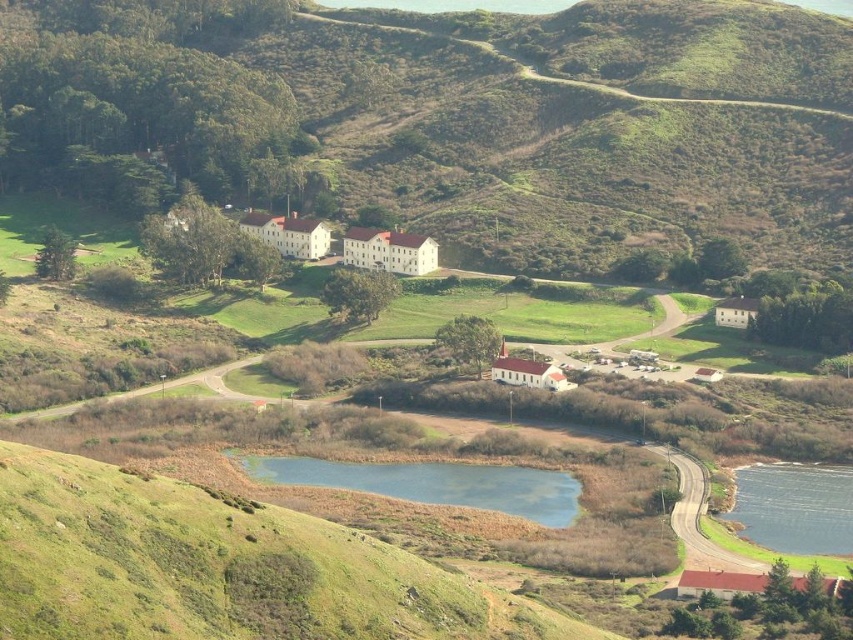
Question: Which object appears farthest from the camera in this image?

Choices:
 (A) blue glassy lake at lower right
 (B) green grassy hill at upper center
 (C) blue grassy lake at center

Answer: (B)

Question: Which object is positioned farthest from the blue grassy lake at center?

Choices:
 (A) blue glassy lake at lower right
 (B) green grassy hill at upper center

Answer: (B)

Question: Is green grassy hill at upper center below blue grassy lake at center?

Choices:
 (A) no
 (B) yes

Answer: (A)

Question: Which object is positioned farthest from the green grassy hill at upper center?

Choices:
 (A) blue glassy lake at lower right
 (B) blue grassy lake at center

Answer: (A)

Question: Is blue grassy lake at center thinner than blue glassy lake at lower right?

Choices:
 (A) no
 (B) yes

Answer: (A)

Question: Is green grassy hill at upper center behind blue glassy lake at lower right?

Choices:
 (A) yes
 (B) no

Answer: (A)